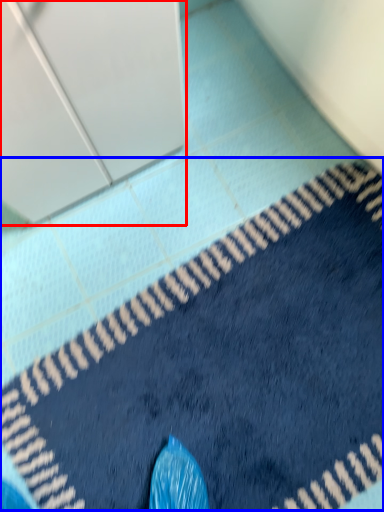
Question: Which object appears farthest to the camera in this image, screen door (highlighted by a red box) or bath mat (highlighted by a blue box)?

Choices:
 (A) screen door
 (B) bath mat

Answer: (B)